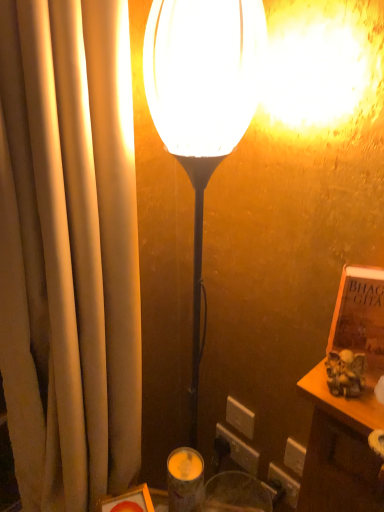
In order to face brown leather book at right, should I rotate leftwards or rightwards?

Rotate your view right by about 22.693°.

Locate an element on the screen. brown leather book at right is located at coordinates (356, 328).

Find the location of a particular element. The height and width of the screenshot is (512, 384). beige fabric curtain at left is located at coordinates (69, 252).

I want to click on brown leather book at right, so click(x=356, y=328).

Could brown leather book at right be considered to be inside matte white lamp at center?

Actually, brown leather book at right is outside matte white lamp at center.

Is matte white lamp at center smaller than brown leather book at right?

Actually, matte white lamp at center might be larger than brown leather book at right.

How many degrees apart are the facing directions of matte white lamp at center and brown leather book at right?

2.86 degrees separate the facing orientations of matte white lamp at center and brown leather book at right.

This screenshot has height=512, width=384. Identify the location of book above the matte white lamp at center (from a real-world perspective). (356, 328).

Does brown leather book at right have a lesser height compared to beige fabric curtain at left?

Correct, brown leather book at right is not as tall as beige fabric curtain at left.

In the image, is brown leather book at right positioned in front of or behind beige fabric curtain at left?

In the image, brown leather book at right appears behind beige fabric curtain at left.

Is brown leather book at right positioned with its back to beige fabric curtain at left?

No, brown leather book at right is not facing away from beige fabric curtain at left.

Is brown leather book at right to the left of beige fabric curtain at left from the viewer's perspective?

In fact, brown leather book at right is to the right of beige fabric curtain at left.

Is white plastic electric outlet at lower center, placed as the 2th electric outlet when sorted from bottom to top, wider or thinner than beige fabric curtain at left?

Considering their sizes, white plastic electric outlet at lower center, placed as the 2th electric outlet when sorted from bottom to top, looks slimmer than beige fabric curtain at left.

From a real-world perspective, is white plastic electric outlet at lower center, placed as the 2th electric outlet when sorted from bottom to top, positioned above or below beige fabric curtain at left?

white plastic electric outlet at lower center, placed as the 2th electric outlet when sorted from bottom to top, is below beige fabric curtain at left.

The image size is (384, 512). I want to click on curtain on the left of the white plastic electric outlet at lower center, placed as the 2th electric outlet when sorted from bottom to top, so click(69, 252).

Considering the sizes of objects beige fabric curtain at left and white plastic electric outlet at lower center, which is counted as the 2th electric outlet, starting from the top, in the image provided, who is wider, beige fabric curtain at left or white plastic electric outlet at lower center, which is counted as the 2th electric outlet, starting from the top,?

beige fabric curtain at left is wider.

From the image's perspective, starting from the beige fabric curtain at left, which electric outlet is the 2nd one below? Please provide its 2D coordinates.

[(240, 450)]

Is beige fabric curtain at left to the left of white plastic electric outlet at lower center, which is counted as the 2th electric outlet, starting from the top, from the viewer's perspective?

Yes.

Measure the distance between beige fabric curtain at left and matte white lamp at center.

They are 9.07 inches apart.

How different are the orientations of beige fabric curtain at left and matte white lamp at center in degrees?

They differ by 51.5 degrees in their facing directions.

Is beige fabric curtain at left in front of or behind matte white lamp at center in the image?

Clearly, beige fabric curtain at left is in front of matte white lamp at center.

Can you confirm if beige fabric curtain at left is bigger than matte white lamp at center?

Indeed, beige fabric curtain at left has a larger size compared to matte white lamp at center.

Considering the positions of objects matte white lamp at center and beige fabric curtain at left in the image provided, who is more to the right, matte white lamp at center or beige fabric curtain at left?

From the viewer's perspective, matte white lamp at center appears more on the right side.

Does matte white lamp at center turn towards beige fabric curtain at left?

No, matte white lamp at center is not aimed at beige fabric curtain at left.

Is matte white lamp at center taller than beige fabric curtain at left?

No, matte white lamp at center is not taller than beige fabric curtain at left.

In the scene shown: How distant is matte white lamp at center from beige fabric curtain at left?

matte white lamp at center is 23.05 centimeters from beige fabric curtain at left.

Does point (229, 413) come farther from viewer compared to point (251, 465)?

Yes, point (229, 413) is farther from viewer.

From the image's perspective, which one is positioned higher, white plastic electric outlet at lower center, placed as the 2th electric outlet when sorted from bottom to top, or white plastic electric outlet at lower center, acting as the first electric outlet starting from the bottom?

white plastic electric outlet at lower center, placed as the 2th electric outlet when sorted from bottom to top, appears higher in the image.

Is white plastic electric outlet at lower center, the first electric outlet in the top-to-bottom sequence, placed right next to white plastic electric outlet at lower center, acting as the first electric outlet starting from the bottom?

Yes, white plastic electric outlet at lower center, the first electric outlet in the top-to-bottom sequence, is beside white plastic electric outlet at lower center, acting as the first electric outlet starting from the bottom.

The width and height of the screenshot is (384, 512). Identify the location of lamp that is on the left side of brown leather book at right. (202, 101).

This screenshot has height=512, width=384. I want to click on book that is behind the beige fabric curtain at left, so click(x=356, y=328).

In the scene shown: From the image, which object appears to be nearer to white plastic electric outlet at lower center, which is counted as the 2th electric outlet, starting from the top, matte white lamp at center or matte glass candle holder at lower center?

Among the two, matte glass candle holder at lower center is located nearer to white plastic electric outlet at lower center, which is counted as the 2th electric outlet, starting from the top.

From the image, which object appears to be farther from beige fabric curtain at left, white plastic electric outlet at lower center, which is counted as the 2th electric outlet, starting from the top, or matte glass candle holder at lower center?

Based on the image, white plastic electric outlet at lower center, which is counted as the 2th electric outlet, starting from the top, appears to be further to beige fabric curtain at left.

Estimate the real-world distances between objects in this image. Which object is closer to matte glass candle holder at lower center, white plastic electric outlet at lower center, placed as the 2th electric outlet when sorted from bottom to top, or beige fabric curtain at left?

Among the two, white plastic electric outlet at lower center, placed as the 2th electric outlet when sorted from bottom to top, is located nearer to matte glass candle holder at lower center.

Looking at the image, which one is located further to beige fabric curtain at left, matte white lamp at center or matte glass candle holder at lower center?

The object further to beige fabric curtain at left is matte glass candle holder at lower center.

From the image, which object appears to be farther from matte white lamp at center, brown leather book at right or white plastic electric outlet at lower center, which is counted as the 2th electric outlet, starting from the top?

Among the two, white plastic electric outlet at lower center, which is counted as the 2th electric outlet, starting from the top, is located further to matte white lamp at center.

Estimate the real-world distances between objects in this image. Which object is closer to white plastic electric outlet at lower center, which is counted as the 2th electric outlet, starting from the top, brown leather book at right or white plastic electric outlet at lower center, the first electric outlet in the top-to-bottom sequence?

white plastic electric outlet at lower center, the first electric outlet in the top-to-bottom sequence, is closer to white plastic electric outlet at lower center, which is counted as the 2th electric outlet, starting from the top.

Looking at the image, which one is located closer to brown leather book at right, white plastic electric outlet at lower center, placed as the 2th electric outlet when sorted from bottom to top, or matte glass candle holder at lower center?

matte glass candle holder at lower center is closer to brown leather book at right.

When comparing their distances from matte white lamp at center, does brown leather book at right or beige fabric curtain at left seem closer?

beige fabric curtain at left is positioned closer to the anchor matte white lamp at center.

You are a GUI agent. You are given a task and a screenshot of the screen. Output one action in this format:
    pyautogui.click(x=<x>, y=<y>)
    Task: Click on the book between beige fabric curtain at left and white plastic electric outlet at lower center, the first electric outlet in the top-to-bottom sequence, from front to back
    
    Given the screenshot: What is the action you would take?
    coord(356,328)

Identify the location of lamp positioned between beige fabric curtain at left and white plastic electric outlet at lower center, acting as the first electric outlet starting from the bottom, from near to far. (202, 101).

You are a GUI agent. You are given a task and a screenshot of the screen. Output one action in this format:
    pyautogui.click(x=<x>, y=<y>)
    Task: Click on the lamp positioned between beige fabric curtain at left and white plastic electric outlet at lower center, placed as the 2th electric outlet when sorted from bottom to top, from near to far
    
    Given the screenshot: What is the action you would take?
    pyautogui.click(x=202, y=101)

Find the location of `candle holder between matte white lamp at center and white plastic electric outlet at lower center, acting as the first electric outlet starting from the bottom, in the front-back direction`. candle holder between matte white lamp at center and white plastic electric outlet at lower center, acting as the first electric outlet starting from the bottom, in the front-back direction is located at coordinates (184, 479).